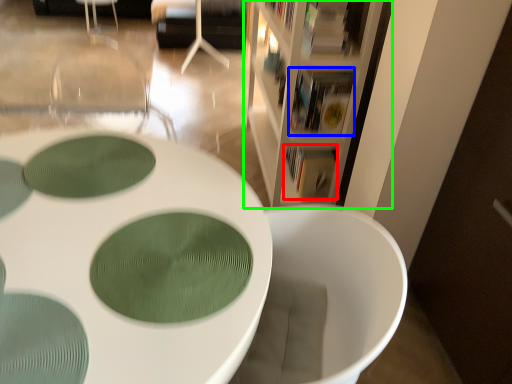
Question: Based on their relative distances, which object is farther from book (highlighted by a red box)? Choose from book (highlighted by a blue box) and bookcase (highlighted by a green box).

Choices:
 (A) book
 (B) bookcase

Answer: (B)